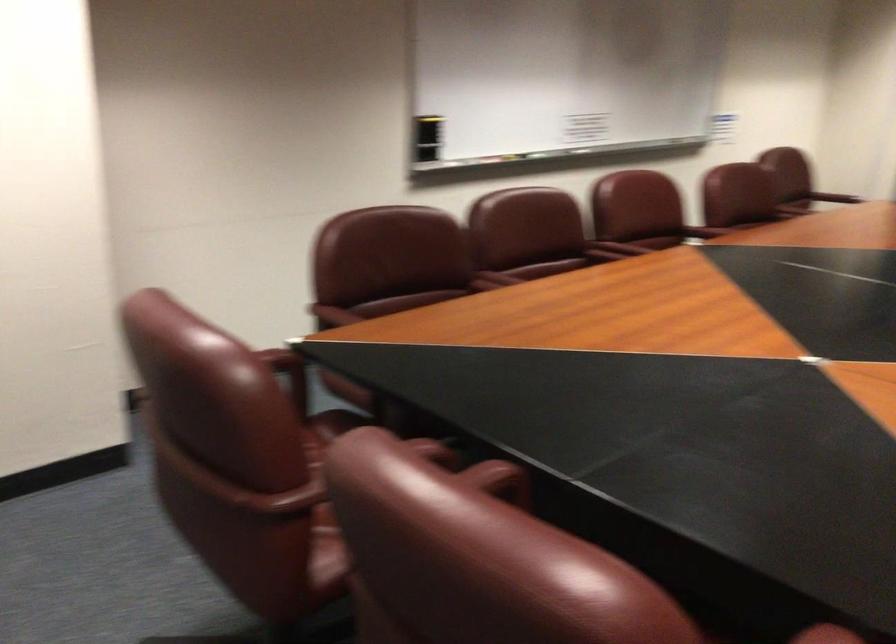
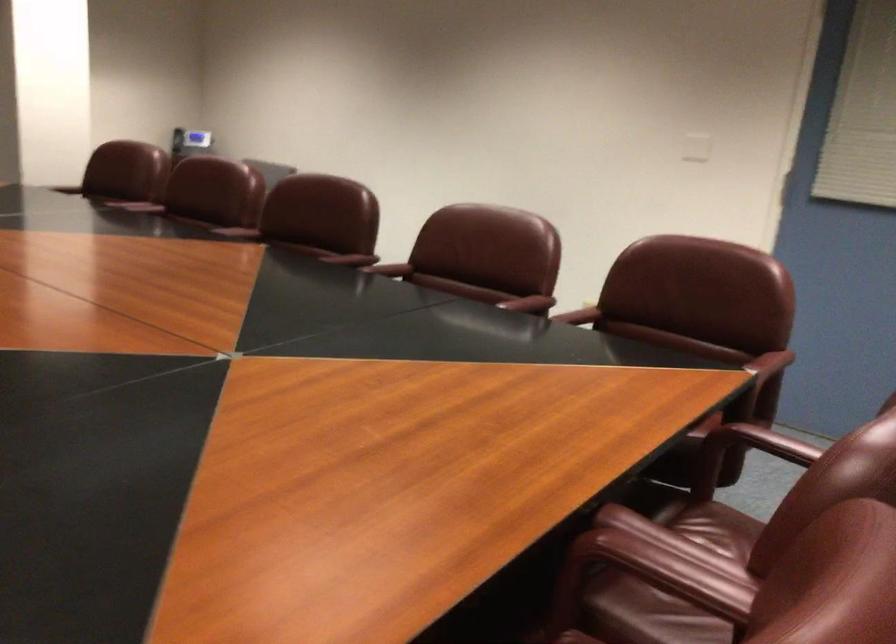
Locate, in the second image, the point that corresponds to [524,281] in the first image.

(657, 573)